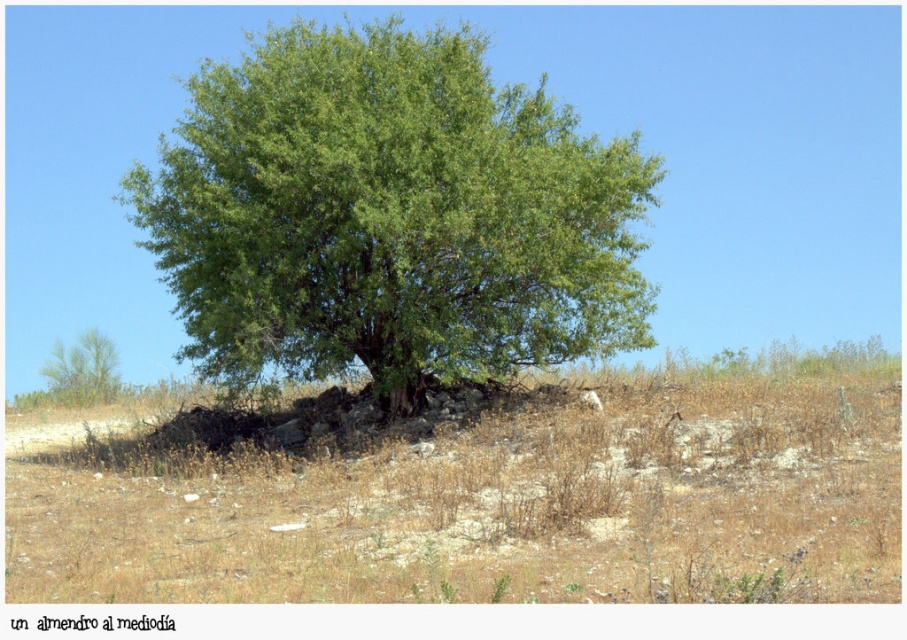
Does green leafy tree at center have a lesser width compared to green leafy tree at lower left?

No, green leafy tree at center is not thinner than green leafy tree at lower left.

Describe the element at coordinates (389, 214) in the screenshot. This screenshot has height=640, width=907. I see `green leafy tree at center` at that location.

You are a GUI agent. You are given a task and a screenshot of the screen. Output one action in this format:
    pyautogui.click(x=<x>, y=<y>)
    Task: Click on the green leafy tree at center
    Image resolution: width=907 pixels, height=640 pixels.
    Given the screenshot: What is the action you would take?
    pyautogui.click(x=389, y=214)

Does brown dry grass at center have a greater height compared to green leafy tree at center?

No.

Which is behind, point (581, 560) or point (336, 310)?

Positioned behind is point (336, 310).

Find the location of a particular element. brown dry grass at center is located at coordinates (471, 493).

Identify the location of brown dry grass at center. (471, 493).

Consider the image. Can you confirm if brown dry grass at center is bigger than green leafy tree at lower left?

Yes, brown dry grass at center is bigger than green leafy tree at lower left.

Is point (857, 419) closer to viewer compared to point (45, 371)?

Yes, point (857, 419) is closer to viewer.

What do you see at coordinates (471, 493) in the screenshot?
I see `brown dry grass at center` at bounding box center [471, 493].

I want to click on brown dry grass at center, so click(x=471, y=493).